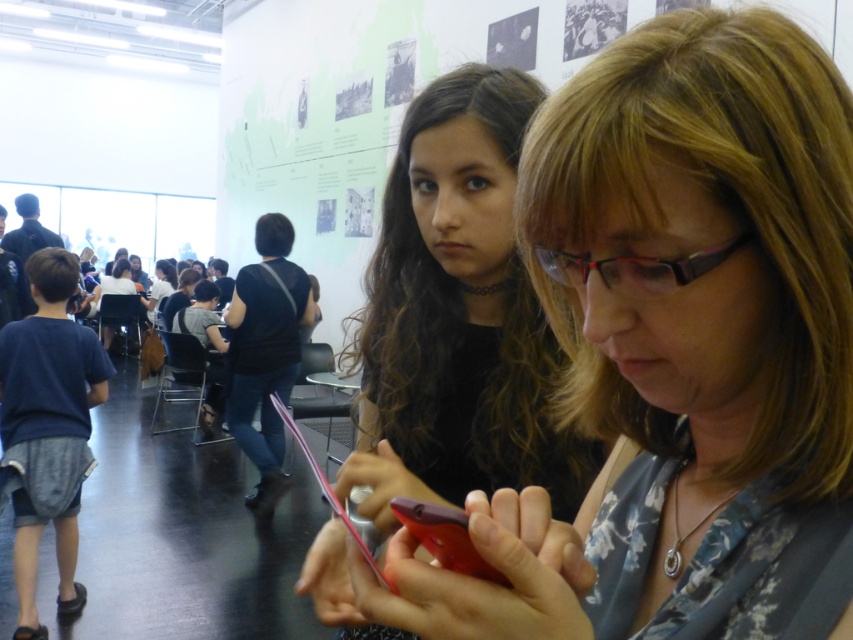
You are designing a display case for an electronics store. The display case has a width of 10 inches. You need to place both the matte black phone at center and the matte black shirt at center inside the case. Can both items fit side by side horizontally within the case?

The matte black phone at center has a width less than the matte black shirt at center. However, without knowing the exact widths of both items, it is impossible to determine if their combined width exceeds the 10 inch display case. Additional measurements are required.

You are standing in the center of the room and see the point marked at coordinates [457,316]. What object is located exactly at that point?

The point marked at coordinates [457,316] is exactly where the matte black shirt at center is located.

You are standing in the museum and want to reach the exit, which is located at point [434,557]. There is an obstacle at point [752,273]. Can you walk directly to the exit without going around the obstacle?

Point [752,273] is in front of point [434,557], so you cannot walk directly to the exit at point [434,557] without going around the obstacle at point [752,273].